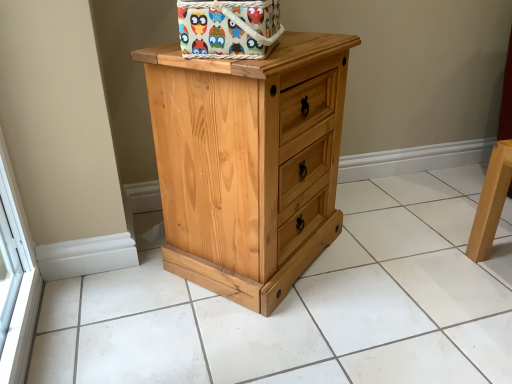
Locate an element on the screen. The height and width of the screenshot is (384, 512). free spot to the left of natural wood chest of drawers at center is located at coordinates (122, 287).